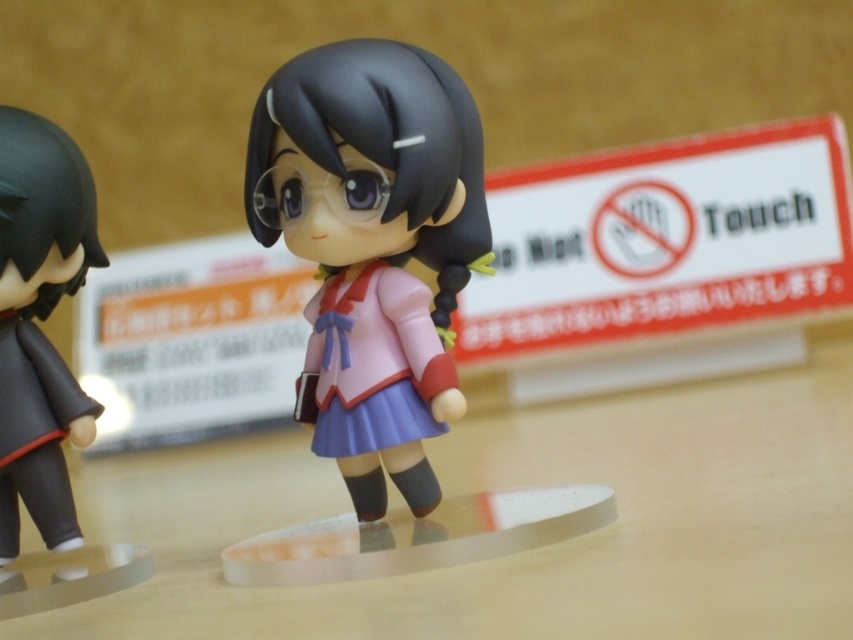
Question: Does matte plastic doll at center have a lesser width compared to matte black figure at left?

Choices:
 (A) no
 (B) yes

Answer: (A)

Question: Among these points, which one is nearest to the camera?

Choices:
 (A) (308, 244)
 (B) (35, 262)

Answer: (A)

Question: Considering the relative positions of matte plastic doll at center and matte black figure at left in the image provided, where is matte plastic doll at center located with respect to matte black figure at left?

Choices:
 (A) right
 (B) left

Answer: (A)

Question: Considering the relative positions of matte plastic doll at center and matte black figure at left in the image provided, where is matte plastic doll at center located with respect to matte black figure at left?

Choices:
 (A) left
 (B) right

Answer: (B)

Question: Which point is closer to the camera?

Choices:
 (A) (363, 384)
 (B) (59, 387)

Answer: (A)